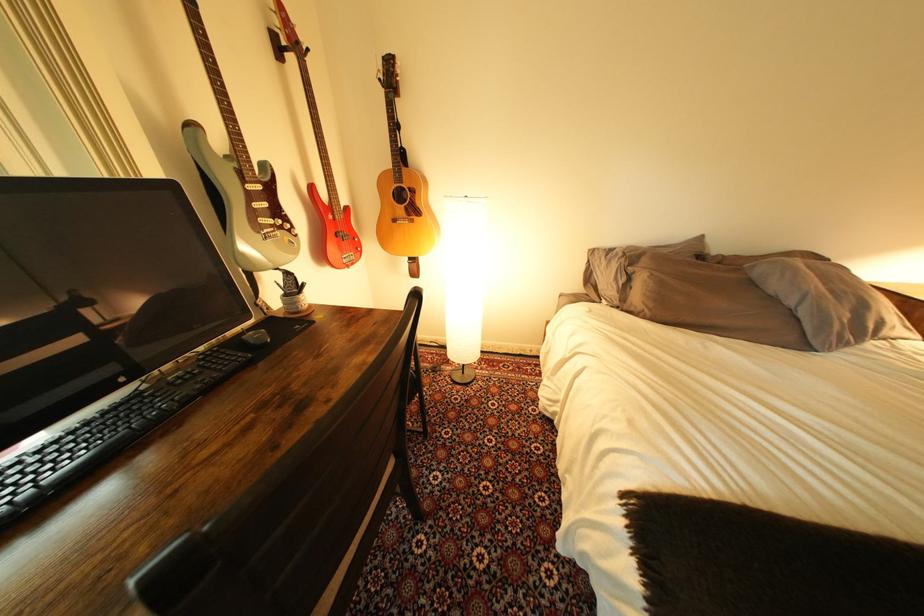
The location [107,432] corresponds to which object?

This point indicates the black computer keyboard.